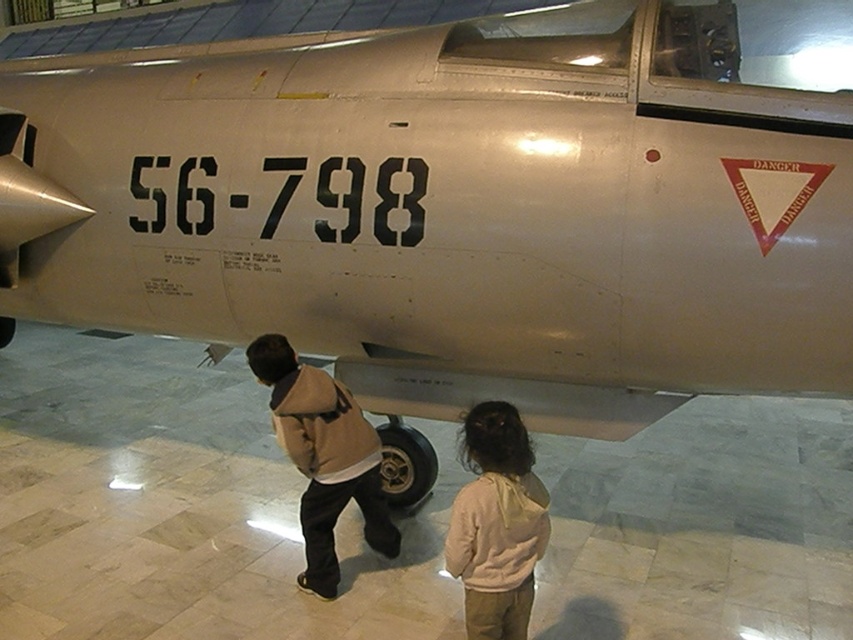
You are a museum visitor standing in front of the vintage fighter jet. You notice two items at the lower center of the display area. Which item is narrower between the white fleece hoodie at lower center and the tan suede jacket at lower center?

The white fleece hoodie at lower center is narrower than the tan suede jacket at lower center.

You are a security guard in the museum and notice the white fleece hoodie at lower center and the black rubber tire at center. According to the museum layout, which object is positioned higher?

The white fleece hoodie at lower center is located above the black rubber tire at center, so it is positioned higher.